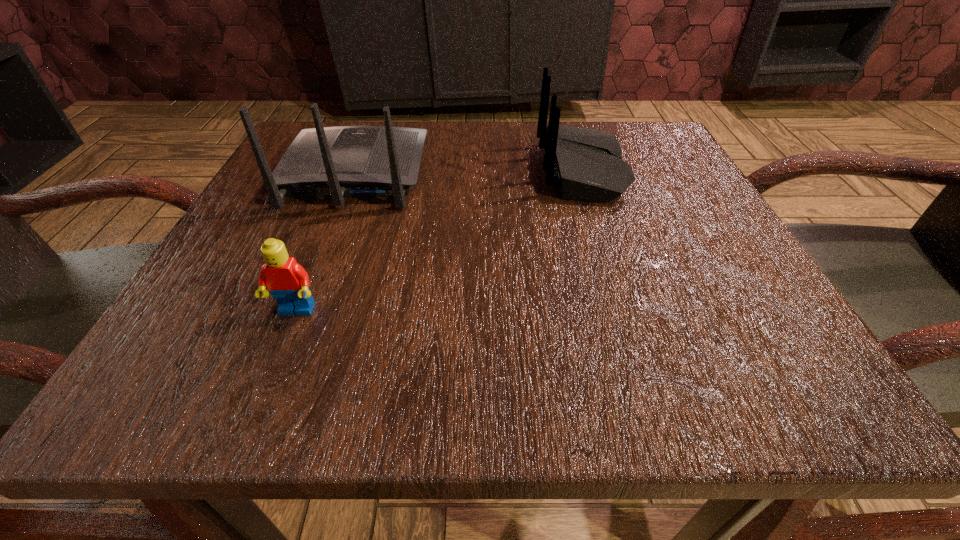
Where is `blank space at the far right corner of the desktop`? The width and height of the screenshot is (960, 540). blank space at the far right corner of the desktop is located at coordinates (606, 125).

You are a GUI agent. You are given a task and a screenshot of the screen. Output one action in this format:
    pyautogui.click(x=<x>, y=<y>)
    Task: Click on the blank space at the near right corner of the desktop
    This screenshot has width=960, height=540.
    Given the screenshot: What is the action you would take?
    pyautogui.click(x=744, y=372)

I want to click on vacant point located between the nearest object and the left router, so click(x=325, y=242).

Identify the location of vacant area that lies between the left router and the shortest object. (325, 242).

Locate an element on the screen. free space that is in between the left router and the right router is located at coordinates (468, 172).

Identify the location of empty location between the left router and the Lego. The height and width of the screenshot is (540, 960). (325, 242).

Where is `vacant area that lies between the left router and the nearest object`? vacant area that lies between the left router and the nearest object is located at coordinates (325, 242).

This screenshot has width=960, height=540. In order to click on vacant space that's between the left router and the right router in this screenshot , I will do `click(468, 172)`.

Identify the location of vacant space that is in between the left router and the right router. Image resolution: width=960 pixels, height=540 pixels. (468, 172).

This screenshot has height=540, width=960. Find the location of `empty space between the Lego and the left router`. empty space between the Lego and the left router is located at coordinates (325, 242).